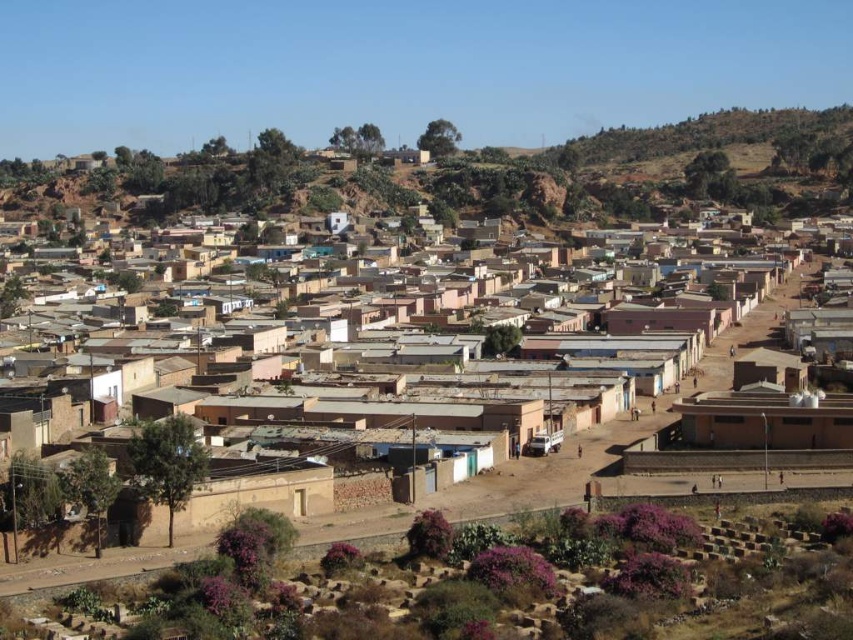
Does brown mud-brick houses at center appear over brown mud hut at lower left?

Indeed, brown mud-brick houses at center is positioned over brown mud hut at lower left.

Is brown mud-brick houses at center below brown mud hut at lower left?

No.

Which is behind, point (439, 401) or point (267, 502)?

The point (439, 401) is more distant.

Locate an element on the screen. brown mud-brick houses at center is located at coordinates [x=381, y=412].

Is brown mud hut at lower left smaller than brown clay hut at lower right?

Yes.

Does brown mud hut at lower left have a lesser width compared to brown clay hut at lower right?

Yes.

The height and width of the screenshot is (640, 853). Find the location of `brown mud hut at lower left`. brown mud hut at lower left is located at coordinates (256, 493).

The height and width of the screenshot is (640, 853). I want to click on brown mud hut at lower left, so click(256, 493).

Who is shorter, brown mud-brick houses at center or brown clay hut at lower right?

Standing shorter between the two is brown clay hut at lower right.

Is brown mud-brick houses at center shorter than brown clay hut at lower right?

Incorrect, brown mud-brick houses at center's height does not fall short of brown clay hut at lower right's.

Between point (222, 508) and point (685, 412), which one is positioned in front?

Point (222, 508) is in front.

In order to click on brown mud-brick houses at center in this screenshot , I will do `click(381, 412)`.